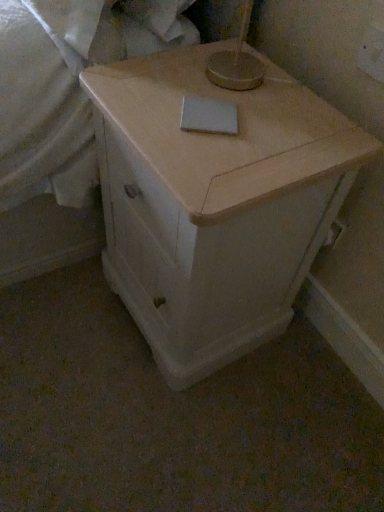
Identify the location of blank space situated above light wood cabinet at center (from a real-world perspective). The width and height of the screenshot is (384, 512). (248, 98).